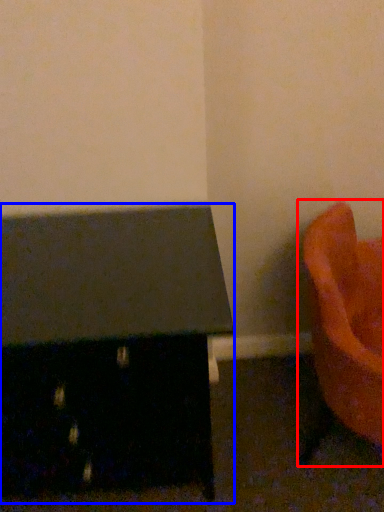
Question: Which object appears farthest to the camera in this image, furniture (highlighted by a red box) or furniture (highlighted by a blue box)?

Choices:
 (A) furniture
 (B) furniture

Answer: (B)